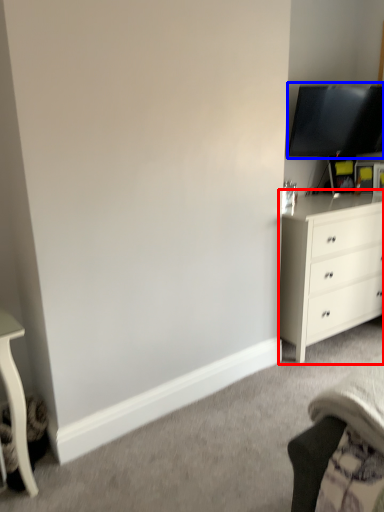
Question: Which of the following is the farthest to the observer, chest of drawers (highlighted by a red box) or television (highlighted by a blue box)?

Choices:
 (A) chest of drawers
 (B) television

Answer: (B)